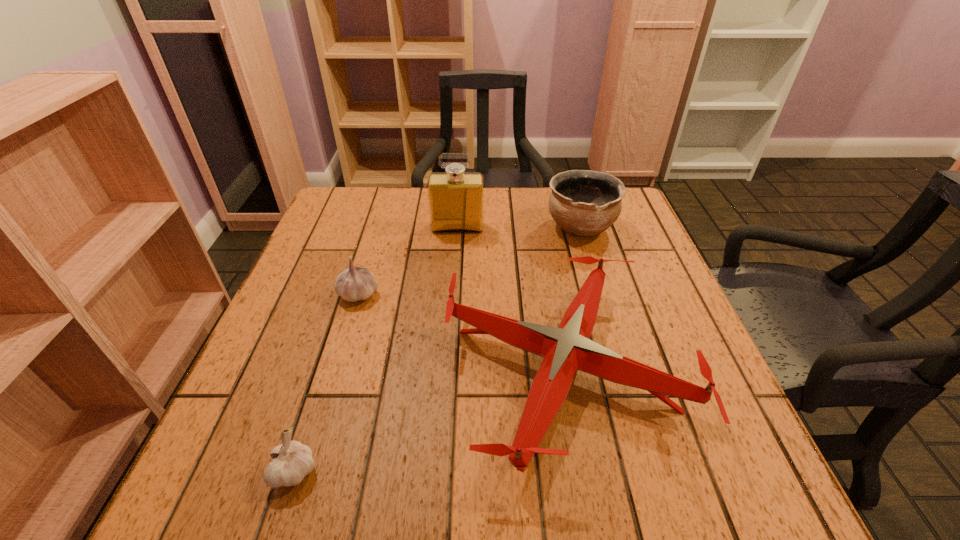
Find the location of a particular element. The height and width of the screenshot is (540, 960). free spot between the perfume and the pottery is located at coordinates (519, 227).

Identify the location of free spot between the shorter garlic and the pottery. (438, 349).

What are the coordinates of `vacant region between the tallest object and the nearer garlic` in the screenshot? It's located at (376, 349).

Find the location of a particular element. The image size is (960, 540). vacant region between the drone and the fourth shortest object is located at coordinates (571, 298).

Locate an element on the screen. The height and width of the screenshot is (540, 960). the second closest object to the farther garlic is located at coordinates (456, 198).

Identify the location of the second closest object relative to the perfume. (353, 284).

Find the location of a particular element. The height and width of the screenshot is (540, 960). free space in the image that satisfies the following two spatial constraints: 1. on the front-facing side of the drone; 2. on the right side of the tallest object is located at coordinates (448, 368).